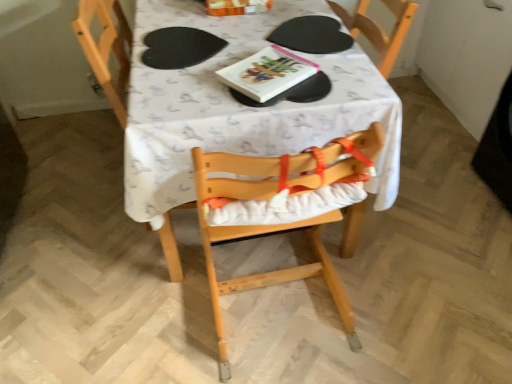
Question: Is white fabric table at center taller or shorter than black matte paper plate at center?

Choices:
 (A) tall
 (B) short

Answer: (A)

Question: Considering the positions of white fabric table at center and black matte paper plate at center in the image, is white fabric table at center wider or thinner than black matte paper plate at center?

Choices:
 (A) thin
 (B) wide

Answer: (B)

Question: Estimate the real-world distances between objects in this image. Which object is closer to the black matte paper plate at center?

Choices:
 (A) white fabric table at center
 (B) hardcover book at center
 (C) natural wood highchair at center

Answer: (B)

Question: Which of these objects is positioned closest to the natural wood highchair at center?

Choices:
 (A) hardcover book at center
 (B) white fabric table at center
 (C) black matte paper plate at center

Answer: (B)